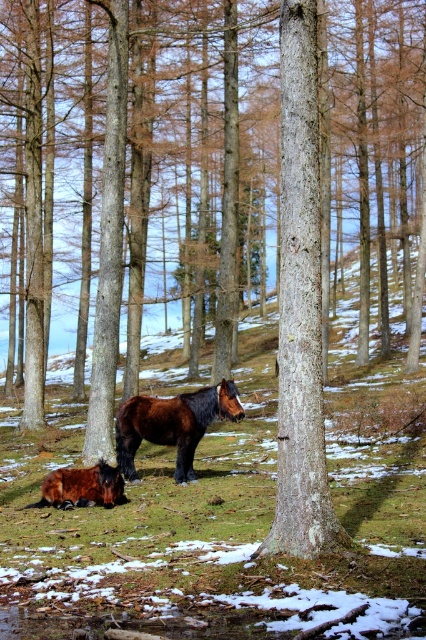
You are a hiker who wants to take a nap in the forest. You see the green grass at center and the shiny brown horse at center. Which one is a better place to lie down?

The green grass at center is located above the shiny brown horse at center, so the grass is higher up and might be a better place to lie down.

You are a hiker trying to navigate through the forest. You see two points marked in the scene. Which point is closer to you, point (x=316, y=456) or point (x=189, y=401)?

Point (x=316, y=456) is in front of point (x=189, y=401), so it is closer to you.

You are a hiker who wants to measure the distance between yourself and the smooth bark tree trunk at center. You have a 30 feet measuring tape. Can you reach the tree trunk with your tape?

The smooth bark tree trunk at center and viewer are 30.20 feet apart. Since the tape is only 30 feet long, it is 0.20 feet short. You cannot reach the tree trunk with your tape.